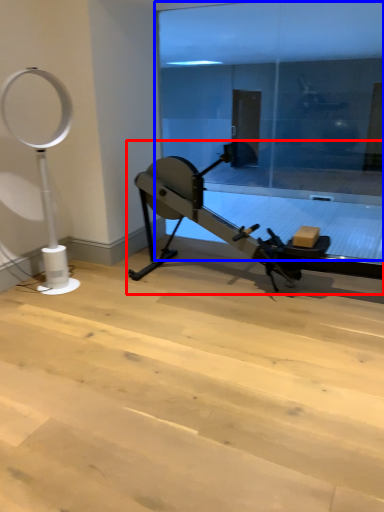
Question: Which point is closer to the camera, stationary bicycle (highlighted by a red box) or glass door (highlighted by a blue box)?

Choices:
 (A) stationary bicycle
 (B) glass door

Answer: (A)